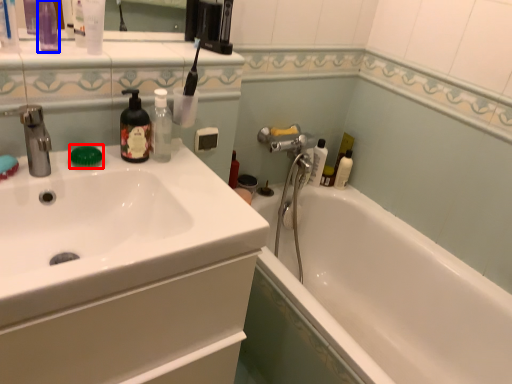
Question: Which object is closer to the camera taking this photo, soap (highlighted by a red box) or toiletry (highlighted by a blue box)?

Choices:
 (A) soap
 (B) toiletry

Answer: (B)